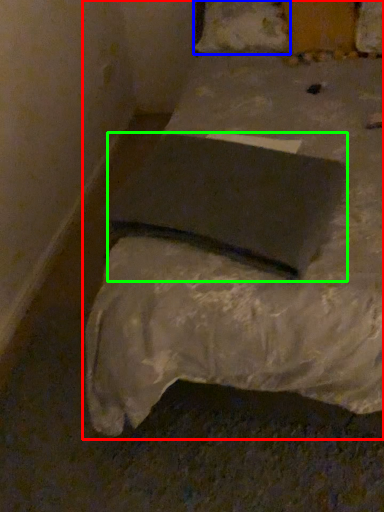
Question: Which object is positioned closest to bed (highlighted by a red box)? Select from pillow (highlighted by a blue box) and pad (highlighted by a green box).

Choices:
 (A) pillow
 (B) pad

Answer: (B)